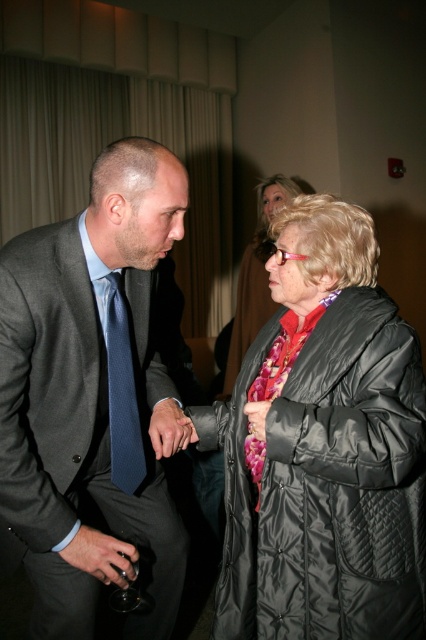
You are a photographer at a formal event. You need to capture a closeup of both the shiny black coat at center and the matte black hand at center in one frame. Given that your camera has a minimum focus distance of 1 meter, will you be able to achieve this shot?

The shiny black coat at center and the matte black hand at center are 1.42 meters apart. Since the minimum focus distance is 1 meter, the photographer can capture both in one frame as the distance between them is greater than the required minimum focus distance.

You are a photographer standing at the scene. You want to take a photo of the shiny black coat at center from a distance that is exactly 8 feet away. Is it possible to do so without moving the coat?

The shiny black coat at center and viewer are 8.52 feet apart. Since 8.52 feet is slightly more than 8 feet, you can move closer by 0.52 feet to achieve the desired distance for the photo.

You are organizing a charity event and need to place a 15 cm wide decorative ribbon on either the matte blue tie at left or the shiny black coat at center. Based on their sizes, which object would the ribbon fit better on?

The matte blue tie at left is smaller than the shiny black coat at center. Since the ribbon is 15 cm wide, it would fit better on the shiny black coat at center as it has a larger surface area to accommodate the ribbon.